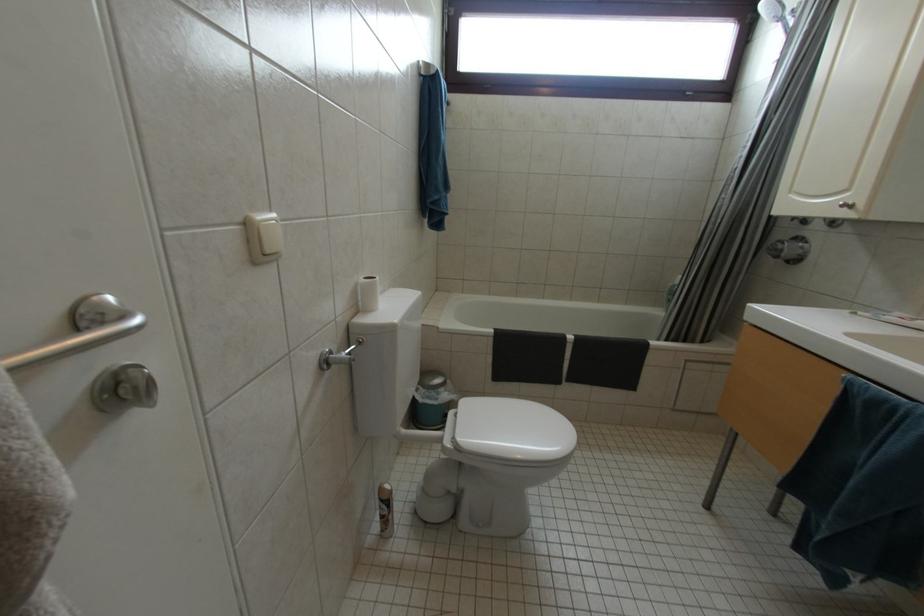
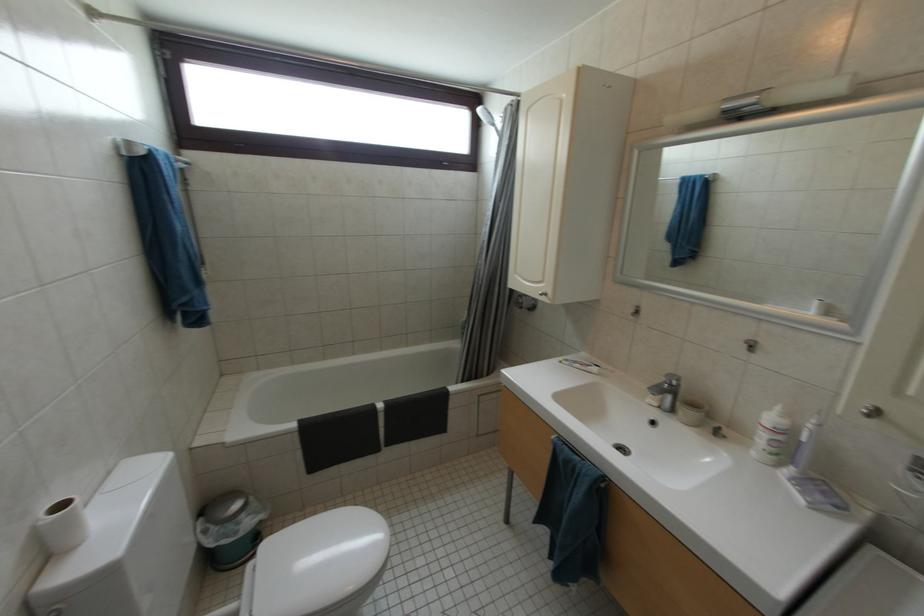
Question: The camera is either moving clockwise (left) or counter-clockwise (right) around the object. The first image is from the beginning of the video and the second image is from the end. Is the camera moving left or right when shooting the video?

Choices:
 (A) Left
 (B) Right

Answer: (A)